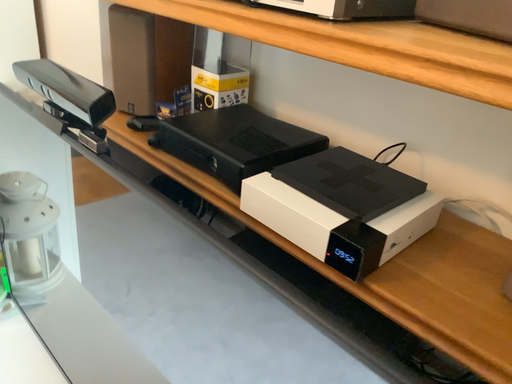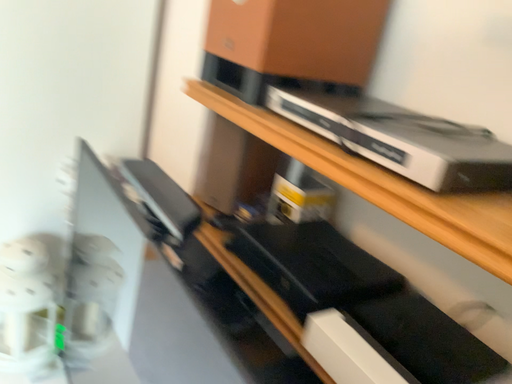
Question: How did the camera likely rotate when shooting the video?

Choices:
 (A) rotated downward
 (B) rotated upward

Answer: (B)